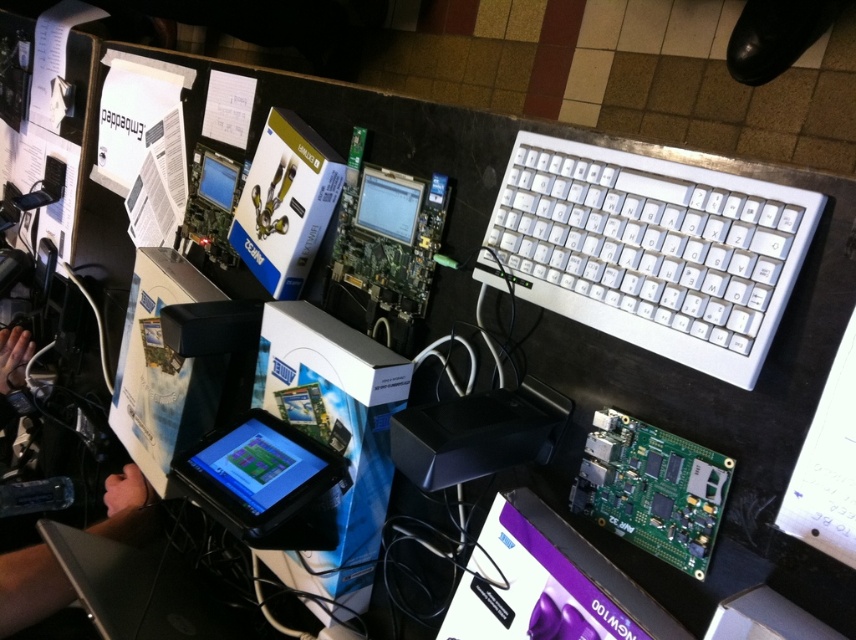
Is matte black tablet at center taller than matte black screen at upper center?

Incorrect, matte black tablet at center's height is not larger of matte black screen at upper center's.

How much distance is there between matte black tablet at center and matte black screen at upper center?

51.77 centimeters

Which is behind, point (266, 477) or point (218, 188)?

The point (218, 188) is more distant.

Where is `matte black tablet at center`? The width and height of the screenshot is (856, 640). matte black tablet at center is located at coordinates click(257, 464).

Can you confirm if white plastic keyboard at upper right is thinner than matte black tablet at center?

Incorrect, white plastic keyboard at upper right's width is not less than matte black tablet at center's.

Who is positioned more to the left, white plastic keyboard at upper right or matte black tablet at center?

Positioned to the left is matte black tablet at center.

Is point (584, 189) closer to viewer compared to point (242, 465)?

Yes, it is.

The height and width of the screenshot is (640, 856). In order to click on white plastic keyboard at upper right in this screenshot , I will do `click(651, 250)`.

What do you see at coordinates (257, 464) in the screenshot? I see `matte black tablet at center` at bounding box center [257, 464].

Can you confirm if matte black tablet at center is taller than matte black monitor at center?

In fact, matte black tablet at center may be shorter than matte black monitor at center.

You are a GUI agent. You are given a task and a screenshot of the screen. Output one action in this format:
    pyautogui.click(x=<x>, y=<y>)
    Task: Click on the matte black tablet at center
    This screenshot has width=856, height=640.
    Given the screenshot: What is the action you would take?
    pos(257,464)